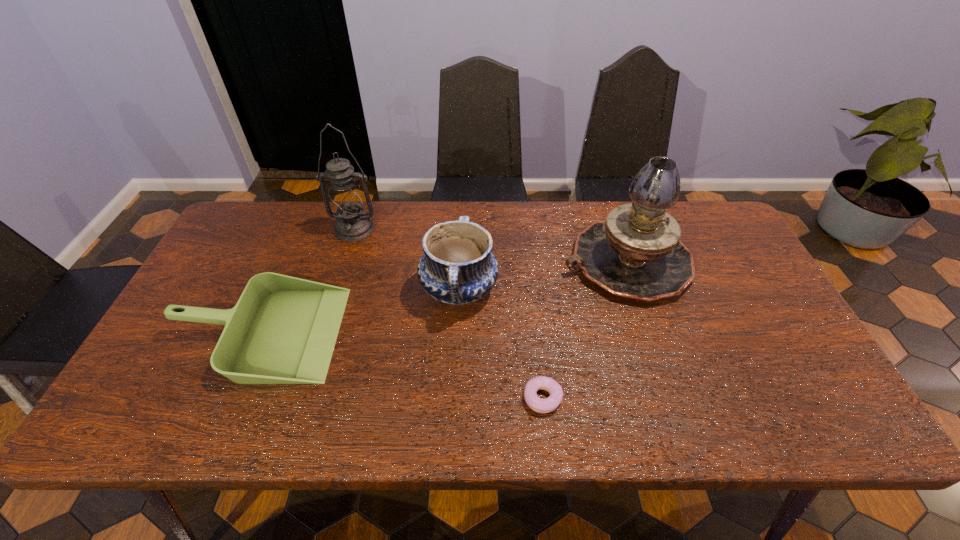
Image resolution: width=960 pixels, height=540 pixels. Identify the location of vacant space located on the scoop of the fourth tallest object. (394, 332).

In order to click on vacant space located on the right of the shortest object in this screenshot , I will do `click(636, 398)`.

Image resolution: width=960 pixels, height=540 pixels. Find the location of `object present at the near edge`. object present at the near edge is located at coordinates (539, 405).

The width and height of the screenshot is (960, 540). In order to click on object located in the left edge section of the desktop in this screenshot , I will do 283,329.

Where is `free space at the far edge`? The width and height of the screenshot is (960, 540). free space at the far edge is located at coordinates (497, 207).

Where is `free spot at the near edge of the desktop`? The width and height of the screenshot is (960, 540). free spot at the near edge of the desktop is located at coordinates (593, 404).

The image size is (960, 540). In order to click on vacant space at the left edge of the desktop in this screenshot , I will do `click(201, 326)`.

You are a GUI agent. You are given a task and a screenshot of the screen. Output one action in this format:
    pyautogui.click(x=<x>, y=<y>)
    Task: Click on the free space between the doughnut and the second shortest object
    
    Given the screenshot: What is the action you would take?
    pyautogui.click(x=401, y=365)

This screenshot has height=540, width=960. Find the location of `vacant region between the rightmost object and the pottery`. vacant region between the rightmost object and the pottery is located at coordinates (542, 276).

Identify the location of free space that is in between the rightmost object and the third object from right to left. coord(542,276).